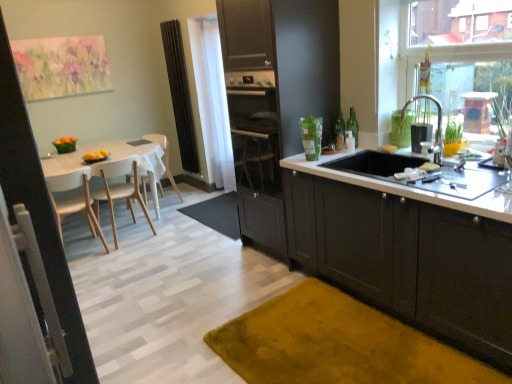
Question: Is white glossy countertop at lower right next to green glass bottle at upper right, the 1th bottle in the right-to-left sequence, and touching it?

Choices:
 (A) no
 (B) yes

Answer: (A)

Question: Is white glossy countertop at lower right positioned in front of green glass bottle at upper right, the 1th bottle in the right-to-left sequence?

Choices:
 (A) yes
 (B) no

Answer: (A)

Question: From a real-world perspective, is white glossy countertop at lower right located higher than green glass bottle at upper right, the 1th bottle in the right-to-left sequence?

Choices:
 (A) yes
 (B) no

Answer: (B)

Question: From the image's perspective, does white glossy countertop at lower right appear lower than green glass bottle at upper right, placed as the 2th bottle when sorted from left to right?

Choices:
 (A) yes
 (B) no

Answer: (A)

Question: Does white glossy countertop at lower right turn towards green glass bottle at upper right, the 1th bottle in the right-to-left sequence?

Choices:
 (A) yes
 (B) no

Answer: (B)

Question: Is white glossy countertop at lower right not near green glass bottle at upper right, the 1th bottle in the right-to-left sequence?

Choices:
 (A) yes
 (B) no

Answer: (B)

Question: From a real-world perspective, is white wood chair at left, which is the 2th chair from front to back, positioned over mustard yellow carpet at lower right, marked as the 1th doormat in a bottom-to-top arrangement, based on gravity?

Choices:
 (A) no
 (B) yes

Answer: (B)

Question: Does white wood chair at left, which is the 2th chair from front to back, appear on the right side of mustard yellow carpet at lower right, the second doormat in the top-to-bottom sequence?

Choices:
 (A) yes
 (B) no

Answer: (B)

Question: From a real-world perspective, is white wood chair at left, the second chair viewed from the back, below mustard yellow carpet at lower right, marked as the 1th doormat in a bottom-to-top arrangement?

Choices:
 (A) no
 (B) yes

Answer: (A)

Question: From the image's perspective, is white wood chair at left, the second chair viewed from the back, on mustard yellow carpet at lower right, marked as the 1th doormat in a bottom-to-top arrangement?

Choices:
 (A) no
 (B) yes

Answer: (B)

Question: Would you say white wood chair at left, the second chair viewed from the back, contains mustard yellow carpet at lower right, the second doormat viewed from the back?

Choices:
 (A) no
 (B) yes

Answer: (A)

Question: Could you tell me if white wood chair at left, which is the 2th chair from front to back, is turned towards mustard yellow carpet at lower right, arranged as the first doormat when viewed from the front?

Choices:
 (A) yes
 (B) no

Answer: (B)

Question: From a real-world perspective, is white glossy countertop at lower right over glossy dark wood cabinets at center, the second cabinetry from the right?

Choices:
 (A) no
 (B) yes

Answer: (A)